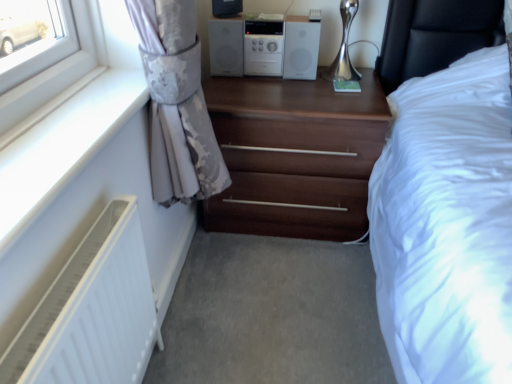
What are the coordinates of `free space on the front side of white plastic stereo at upper center` in the screenshot? It's located at (296, 101).